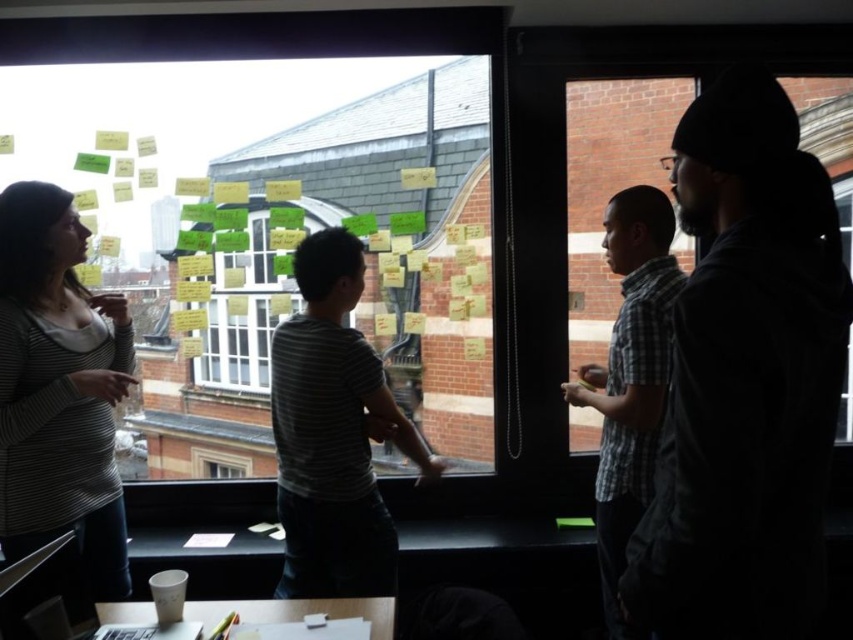
Which is more to the right, striped fabric shirt at left or plaid cotton shirt at right?

plaid cotton shirt at right is more to the right.

From the picture: Does striped fabric shirt at left have a greater height compared to plaid cotton shirt at right?

No, striped fabric shirt at left is not taller than plaid cotton shirt at right.

Image resolution: width=853 pixels, height=640 pixels. Identify the location of striped fabric shirt at left. (59, 392).

Who is lower down, plaid cotton shirt at right or white paper cup at lower left?

Positioned lower is white paper cup at lower left.

Who is shorter, plaid cotton shirt at right or white paper cup at lower left?

white paper cup at lower left is shorter.

Where is `plaid cotton shirt at right`? This screenshot has width=853, height=640. plaid cotton shirt at right is located at coordinates (630, 378).

Is striped cotton shirt at center smaller than plaid cotton shirt at right?

Yes, striped cotton shirt at center is smaller than plaid cotton shirt at right.

Between point (346, 276) and point (625, 228), which one is positioned in front?

Point (346, 276) is in front.

Locate an element on the screen. The height and width of the screenshot is (640, 853). striped cotton shirt at center is located at coordinates (334, 433).